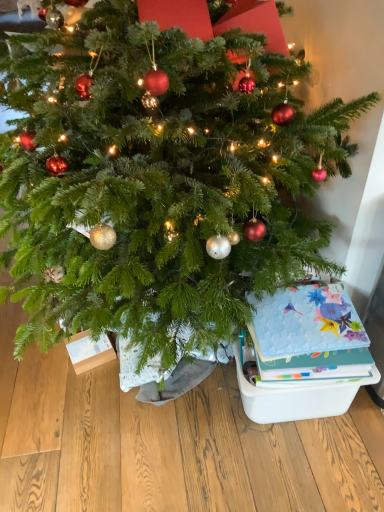
Question: Is floral paper card at lower right positioned with its back to matte plastic storage box at lower right?

Choices:
 (A) no
 (B) yes

Answer: (A)

Question: Does floral paper card at lower right have a lesser height compared to matte plastic storage box at lower right?

Choices:
 (A) no
 (B) yes

Answer: (B)

Question: Does floral paper card at lower right appear on the left side of matte plastic storage box at lower right?

Choices:
 (A) yes
 (B) no

Answer: (A)

Question: Considering the relative sizes of floral paper card at lower right and matte plastic storage box at lower right in the image provided, is floral paper card at lower right thinner than matte plastic storage box at lower right?

Choices:
 (A) no
 (B) yes

Answer: (B)

Question: Is floral paper card at lower right wider than matte plastic storage box at lower right?

Choices:
 (A) no
 (B) yes

Answer: (A)

Question: Considering the relative sizes of floral paper card at lower right and matte plastic storage box at lower right in the image provided, is floral paper card at lower right bigger than matte plastic storage box at lower right?

Choices:
 (A) yes
 (B) no

Answer: (B)

Question: Could you tell me if matte plastic storage box at lower right is turned towards floral paper card at lower right?

Choices:
 (A) no
 (B) yes

Answer: (A)

Question: Is matte plastic storage box at lower right not inside floral paper card at lower right?

Choices:
 (A) yes
 (B) no

Answer: (A)

Question: Considering the relative sizes of matte plastic storage box at lower right and floral paper card at lower right in the image provided, is matte plastic storage box at lower right bigger than floral paper card at lower right?

Choices:
 (A) yes
 (B) no

Answer: (A)

Question: From a real-world perspective, is matte plastic storage box at lower right physically above floral paper card at lower right?

Choices:
 (A) yes
 (B) no

Answer: (B)

Question: Can you confirm if matte plastic storage box at lower right is shorter than floral paper card at lower right?

Choices:
 (A) no
 (B) yes

Answer: (A)

Question: Considering the relative sizes of matte plastic storage box at lower right and floral paper card at lower right in the image provided, is matte plastic storage box at lower right smaller than floral paper card at lower right?

Choices:
 (A) yes
 (B) no

Answer: (B)

Question: Is matte plastic storage box at lower right in front of or behind floral paper card at lower right in the image?

Choices:
 (A) front
 (B) behind

Answer: (B)